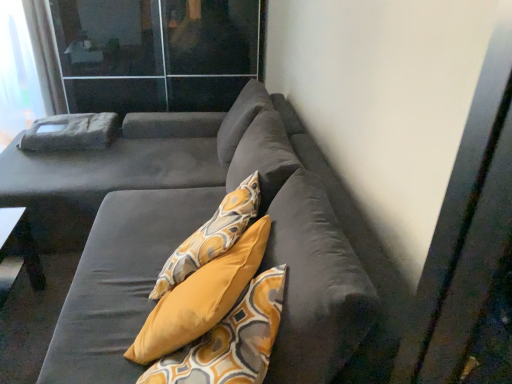
Question: Is white sheer curtain at upper left next to suede gray couch at center?

Choices:
 (A) no
 (B) yes

Answer: (A)

Question: Is white sheer curtain at upper left closer to the viewer compared to suede gray couch at center?

Choices:
 (A) no
 (B) yes

Answer: (A)

Question: Does white sheer curtain at upper left contain suede gray couch at center?

Choices:
 (A) yes
 (B) no

Answer: (B)

Question: Is white sheer curtain at upper left wider than suede gray couch at center?

Choices:
 (A) yes
 (B) no

Answer: (B)

Question: Could you tell me if white sheer curtain at upper left is turned towards suede gray couch at center?

Choices:
 (A) no
 (B) yes

Answer: (B)

Question: Considering the positions of transparent glass screen door at upper left and suede gray couch at center in the image, is transparent glass screen door at upper left taller or shorter than suede gray couch at center?

Choices:
 (A) tall
 (B) short

Answer: (A)

Question: From a real-world perspective, is transparent glass screen door at upper left above or below suede gray couch at center?

Choices:
 (A) above
 (B) below

Answer: (A)

Question: Is transparent glass screen door at upper left inside the boundaries of suede gray couch at center, or outside?

Choices:
 (A) outside
 (B) inside

Answer: (A)

Question: Is point (146, 0) closer or farther from the camera than point (111, 317)?

Choices:
 (A) closer
 (B) farther

Answer: (B)

Question: Relative to white sheer curtain at upper left, is transparent glass screen door at upper left in front or behind?

Choices:
 (A) front
 (B) behind

Answer: (A)

Question: Visually, is transparent glass screen door at upper left positioned to the left or to the right of white sheer curtain at upper left?

Choices:
 (A) right
 (B) left

Answer: (A)

Question: Considering the positions of transparent glass screen door at upper left and white sheer curtain at upper left in the image, is transparent glass screen door at upper left bigger or smaller than white sheer curtain at upper left?

Choices:
 (A) small
 (B) big

Answer: (B)

Question: In terms of width, does transparent glass screen door at upper left look wider or thinner when compared to white sheer curtain at upper left?

Choices:
 (A) wide
 (B) thin

Answer: (A)

Question: From the image's perspective, is white sheer curtain at upper left above or below transparent glass screen door at upper left?

Choices:
 (A) below
 (B) above

Answer: (B)

Question: Relative to transparent glass screen door at upper left, is white sheer curtain at upper left in front or behind?

Choices:
 (A) front
 (B) behind

Answer: (B)